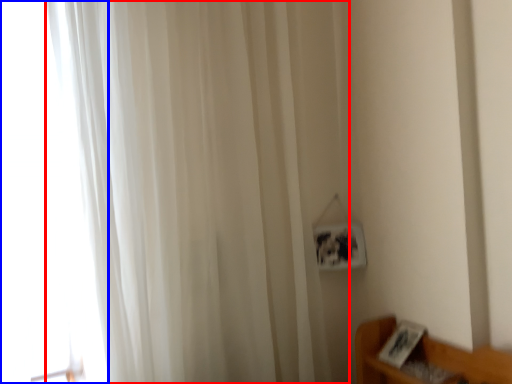
Question: Which object appears farthest to the camera in this image, curtain (highlighted by a red box) or glass door (highlighted by a blue box)?

Choices:
 (A) curtain
 (B) glass door

Answer: (B)